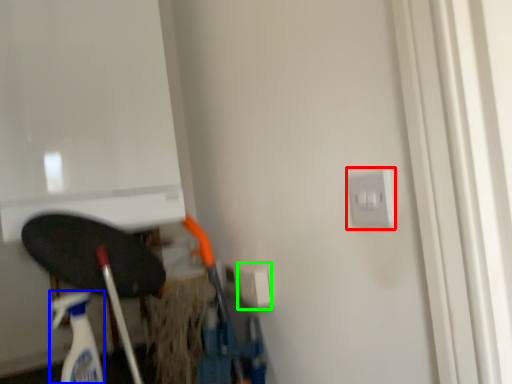
Question: Based on their relative distances, which object is farther from electric outlet (highlighted by a red box)? Choose from cleaning product (highlighted by a blue box) and electric outlet (highlighted by a green box).

Choices:
 (A) cleaning product
 (B) electric outlet

Answer: (A)